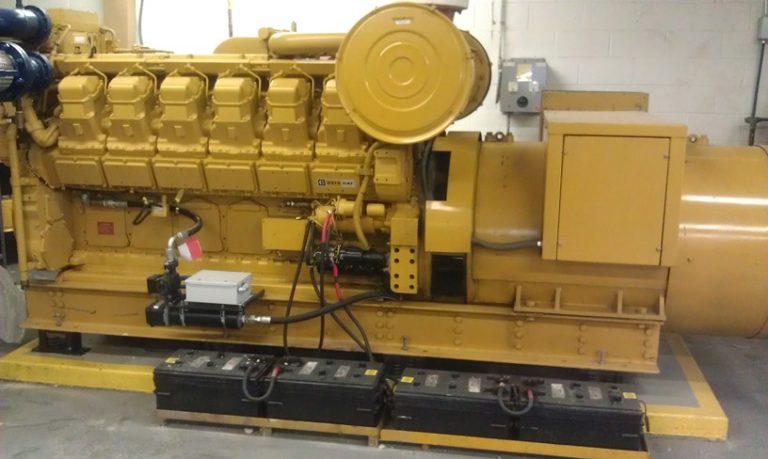
The width and height of the screenshot is (768, 459). I want to click on window, so click(173, 12).